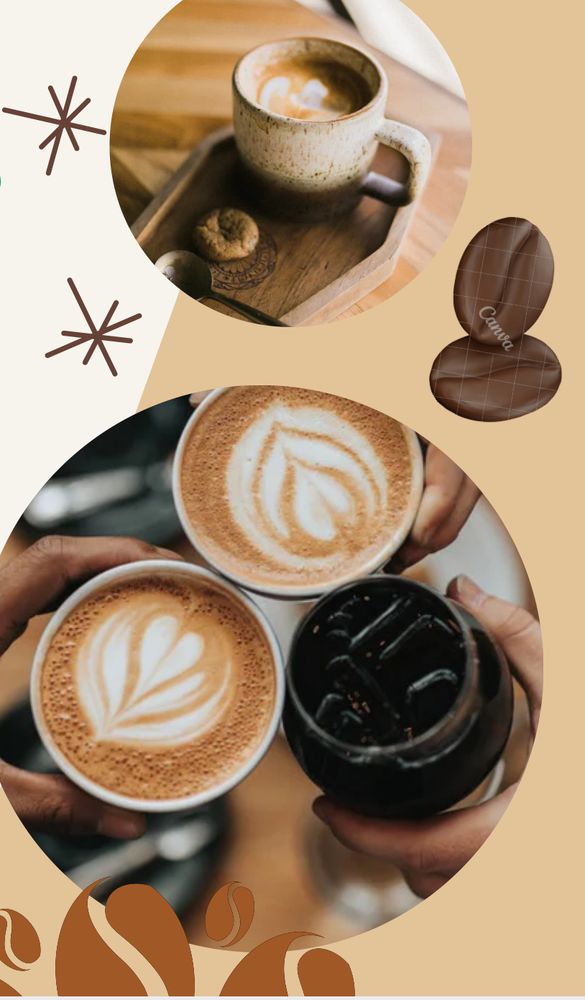
Where is `cups and jars`? The height and width of the screenshot is (1000, 585). cups and jars is located at coordinates (147, 562), (280, 591), (281, 118), (459, 616).